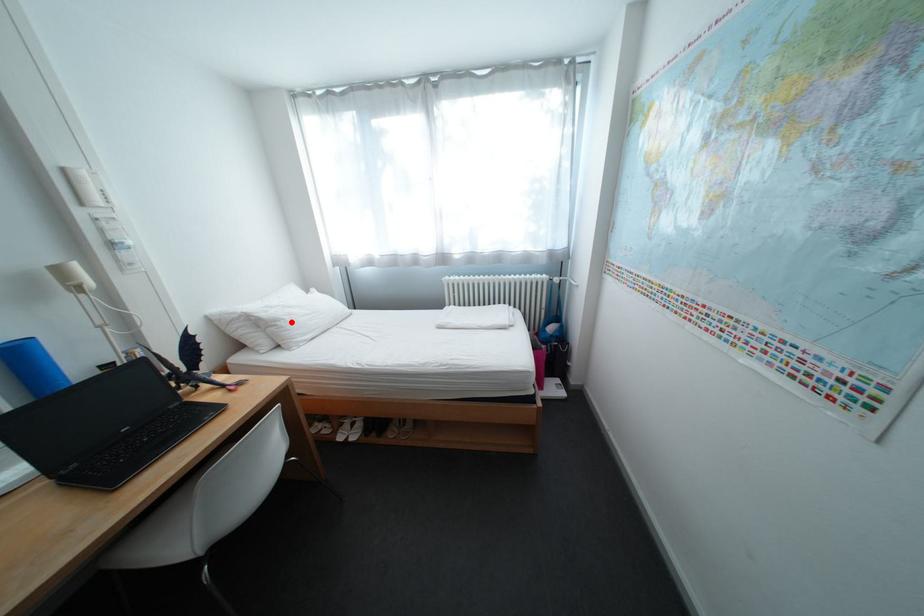
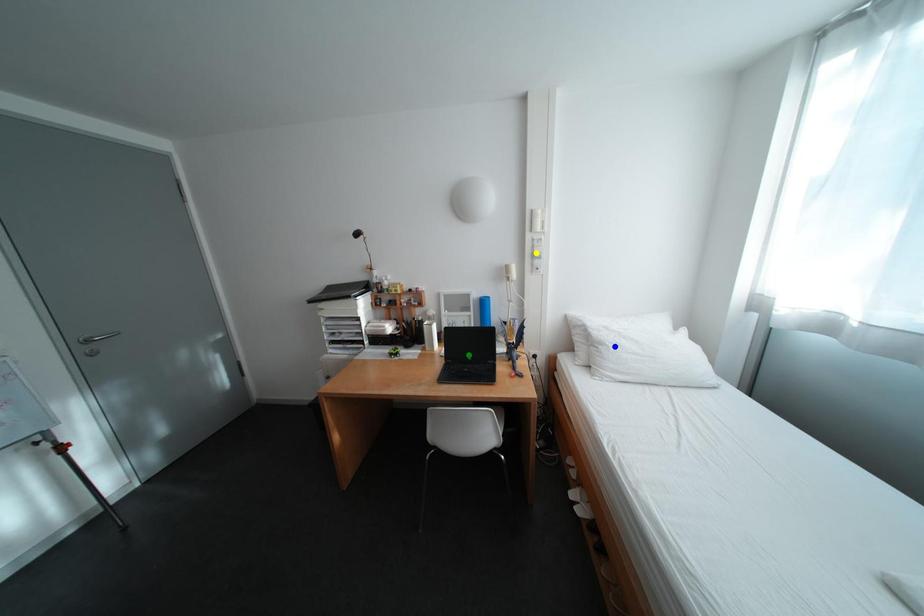
Question: I am providing you with two images of the same scene from different viewpoints. A red point is marked on the first image. You are given multiple points on the second image. Which point in image 2 represents the same 3d spot as the red point in image 1?

Choices:
 (A) yellow point
 (B) green point
 (C) blue point

Answer: (C)